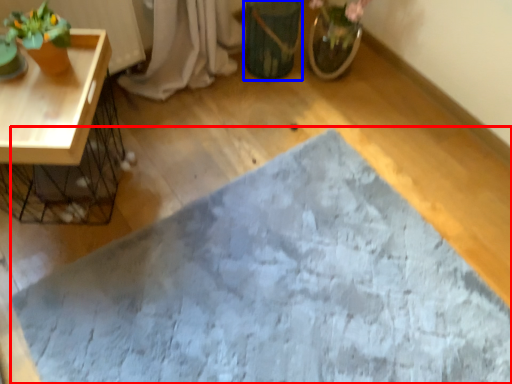
Question: Which of the following is the farthest to the observer, bath mat (highlighted by a red box) or flowerpot (highlighted by a blue box)?

Choices:
 (A) bath mat
 (B) flowerpot

Answer: (B)